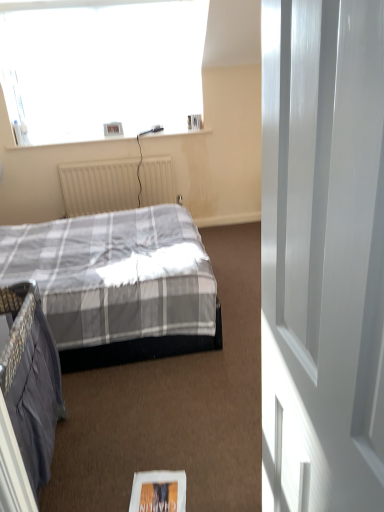
You are a GUI agent. You are given a task and a screenshot of the screen. Output one action in this format:
    pyautogui.click(x=<x>, y=<y>)
    Task: Click on the empty space that is ontop of white paper magazine at lower center (from a real-world perspective)
    
    Given the screenshot: What is the action you would take?
    pyautogui.click(x=158, y=494)